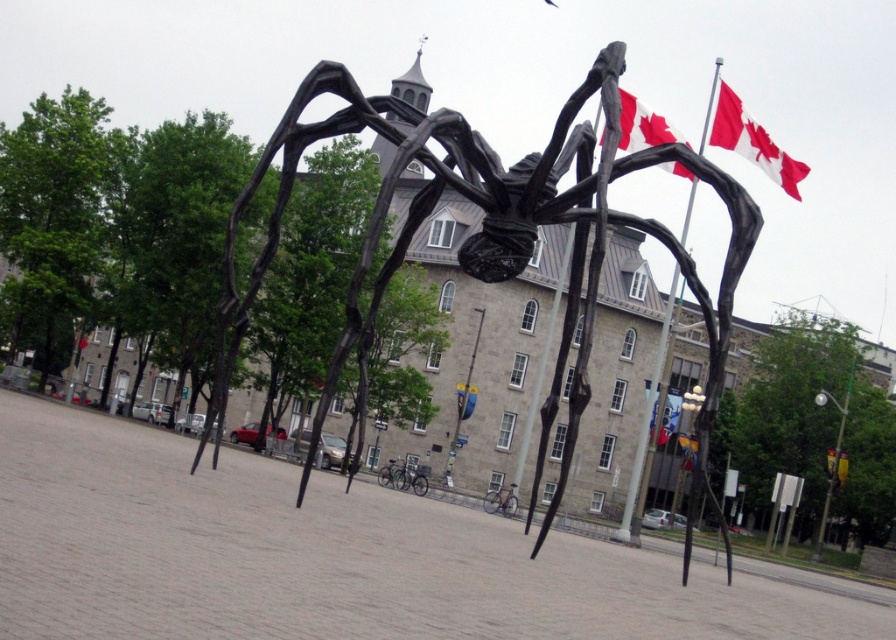
Consider the image. Between black matte spider at center and red fabric flag at center, which one is positioned higher?

Positioned higher is black matte spider at center.

Is point (714, 324) farther from camera compared to point (652, 426)?

No.

Which is behind, point (381, 184) or point (664, 440)?

Positioned behind is point (664, 440).

Identify the location of black matte spider at center. (497, 225).

Who is more forward, (332, 83) or (621, 96)?

Positioned in front is point (332, 83).

Which is above, black matte spider at center or red/white fabric flag at upper right?

red/white fabric flag at upper right is higher up.

Is point (708, 348) farther from viewer compared to point (625, 112)?

That is True.

I want to click on black matte spider at center, so click(497, 225).

Which is behind, point (632, 160) or point (722, 96)?

Positioned behind is point (722, 96).

Can you confirm if black matte spider at center is taller than red fabric flag at upper right?

Yes.

Is point (691, 518) farther from viewer compared to point (767, 176)?

No, it is in front of (767, 176).

The image size is (896, 640). In order to click on black matte spider at center in this screenshot , I will do `click(497, 225)`.